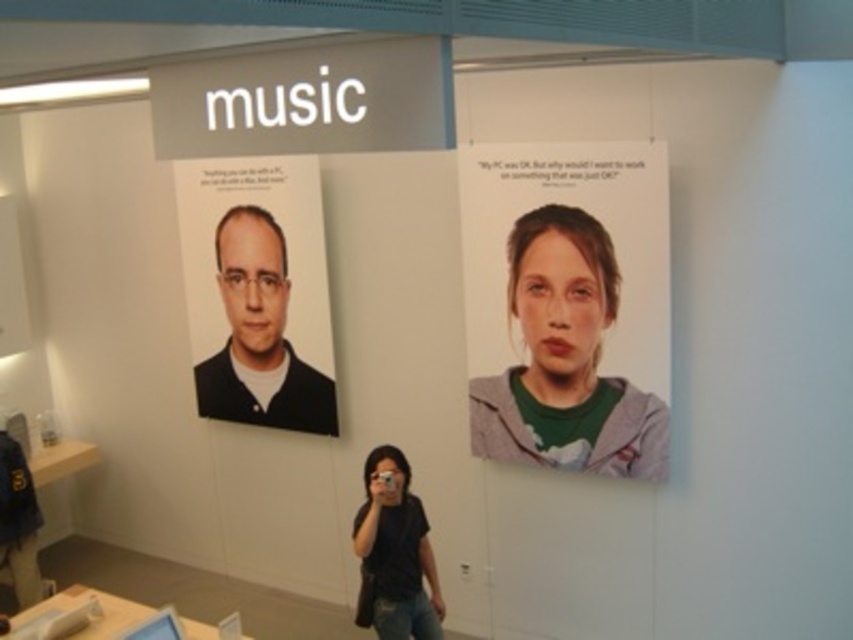
Question: Which of the following is the farthest from the observer?

Choices:
 (A) (303, 385)
 (B) (653, 400)

Answer: (A)

Question: Does matte black portrait at left lie behind black matte shirt at lower center?

Choices:
 (A) no
 (B) yes

Answer: (B)

Question: Which object appears closest to the camera in this image?

Choices:
 (A) black matte shirt at lower center
 (B) matte black portrait at left
 (C) green fabric face at upper right

Answer: (A)

Question: Which point appears farthest from the camera in this image?

Choices:
 (A) (607, 288)
 (B) (398, 611)

Answer: (A)

Question: Is the position of matte black portrait at left less distant than that of black matte shirt at lower center?

Choices:
 (A) no
 (B) yes

Answer: (A)

Question: Does green fabric face at upper right come behind matte black portrait at left?

Choices:
 (A) yes
 (B) no

Answer: (B)